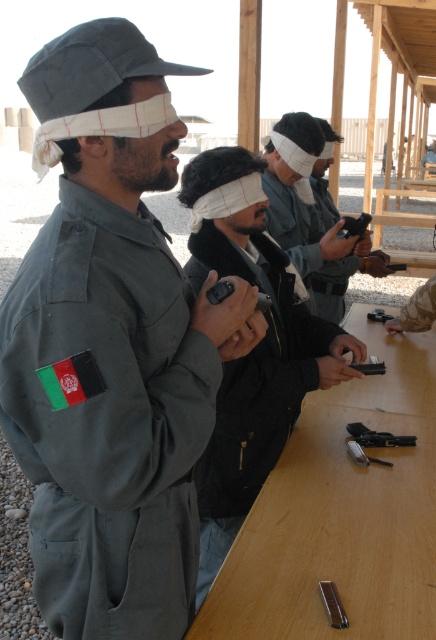
You are a trainee in the exercise and need to retrieve your pistol from the table. Can you reach the matte black pistol at center while standing at the wooden table at center without moving your feet?

The distance between the wooden table at center and the matte black pistol at center is 30.66 inches. Since this distance is greater than typical arm reach, you cannot reach the pistol without moving your feet.

You are a trainee in the exercise and need to place your matte black pistol at center onto the wooden table at center. Which direction should you move the pistol to reach the table?

The wooden table at center is positioned on the left side of the matte black pistol at center, so you should move the pistol to the left to place it onto the wooden table at center.